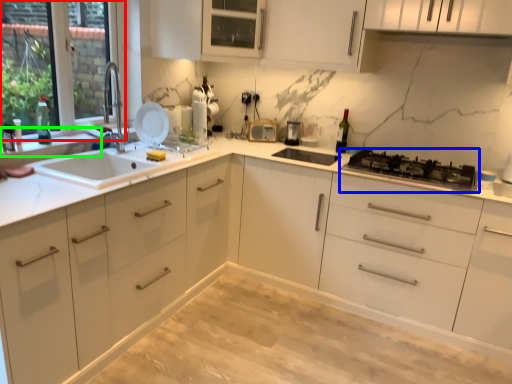
Question: Based on their relative distances, which object is nearer to window (highlighted by a red box)? Choose from gas stove (highlighted by a blue box) and window sill (highlighted by a green box).

Choices:
 (A) gas stove
 (B) window sill

Answer: (B)